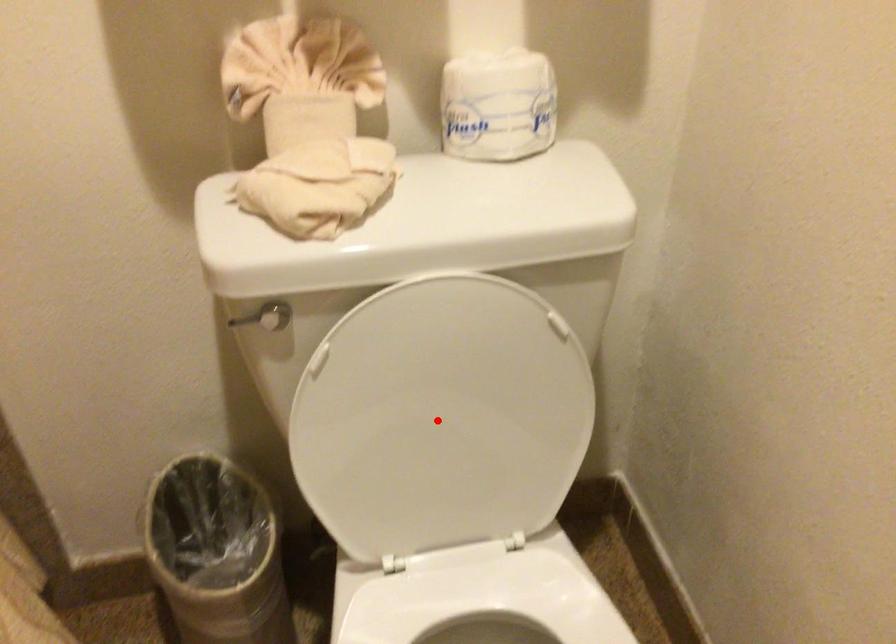
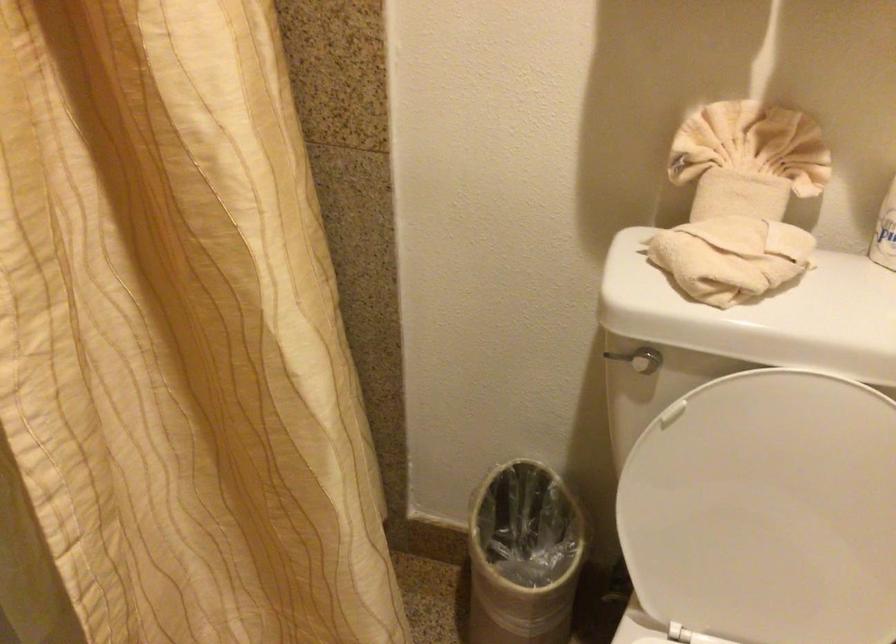
Locate, in the second image, the point that corresponds to the highlighted location in the first image.

(767, 511)